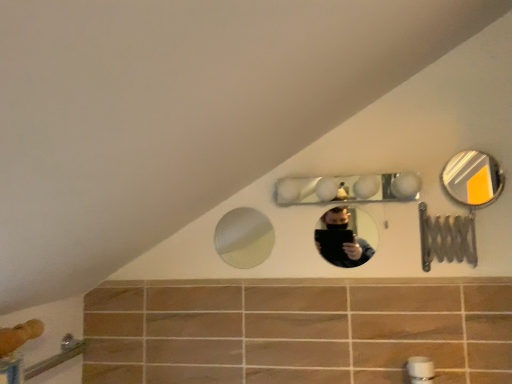
Question: Is clear glass mirror at upper center, the 3th mirror viewed from the left, to the left of metallic silver mirror at upper right, arranged as the fourth mirror when viewed from the left, from the viewer's perspective?

Choices:
 (A) yes
 (B) no

Answer: (A)

Question: Does clear glass mirror at upper center, the 2th mirror when ordered from right to left, turn towards metallic silver mirror at upper right, which is counted as the first mirror, starting from the right?

Choices:
 (A) no
 (B) yes

Answer: (A)

Question: Can metallic silver mirror at upper right, which is counted as the first mirror, starting from the right, be found inside clear glass mirror at upper center, the 3th mirror viewed from the left?

Choices:
 (A) yes
 (B) no

Answer: (B)

Question: Does clear glass mirror at upper center, the 3th mirror viewed from the left, have a lesser height compared to metallic silver mirror at upper right, which is counted as the first mirror, starting from the right?

Choices:
 (A) yes
 (B) no

Answer: (A)

Question: Does clear glass mirror at upper center, the 3th mirror viewed from the left, have a lesser width compared to metallic silver mirror at upper right, arranged as the fourth mirror when viewed from the left?

Choices:
 (A) yes
 (B) no

Answer: (B)

Question: Considering the positions of white glossy mirror at upper center, which is the third mirror from right to left, and clear glass mirror at upper center, the 2th mirror when ordered from right to left, in the image, is white glossy mirror at upper center, which is the third mirror from right to left, taller or shorter than clear glass mirror at upper center, the 2th mirror when ordered from right to left,?

Choices:
 (A) short
 (B) tall

Answer: (A)

Question: In the image, is white glossy mirror at upper center, which is the third mirror from right to left, positioned in front of or behind clear glass mirror at upper center, the 2th mirror when ordered from right to left?

Choices:
 (A) behind
 (B) front

Answer: (B)

Question: Does point (336, 198) appear closer or farther from the camera than point (361, 253)?

Choices:
 (A) closer
 (B) farther

Answer: (A)

Question: Considering the positions of white glossy mirror at upper center, which is the third mirror from right to left, and clear glass mirror at upper center, the 2th mirror when ordered from right to left, in the image, is white glossy mirror at upper center, which is the third mirror from right to left, bigger or smaller than clear glass mirror at upper center, the 2th mirror when ordered from right to left,?

Choices:
 (A) big
 (B) small

Answer: (A)

Question: Considering the positions of white glossy mirror at upper center, positioned as the second mirror in left-to-right order, and metallic silver mirror at upper right, which is counted as the first mirror, starting from the right, in the image, is white glossy mirror at upper center, positioned as the second mirror in left-to-right order, taller or shorter than metallic silver mirror at upper right, which is counted as the first mirror, starting from the right,?

Choices:
 (A) tall
 (B) short

Answer: (B)

Question: Which is correct: white glossy mirror at upper center, positioned as the second mirror in left-to-right order, is inside metallic silver mirror at upper right, which is counted as the first mirror, starting from the right, or outside of it?

Choices:
 (A) inside
 (B) outside

Answer: (B)

Question: In terms of width, does white glossy mirror at upper center, positioned as the second mirror in left-to-right order, look wider or thinner when compared to metallic silver mirror at upper right, arranged as the fourth mirror when viewed from the left?

Choices:
 (A) wide
 (B) thin

Answer: (A)

Question: Does point (316, 190) appear closer or farther from the camera than point (478, 185)?

Choices:
 (A) closer
 (B) farther

Answer: (A)

Question: In the image, is clear glass mirror at upper center, the 2th mirror when ordered from right to left, positioned in front of or behind metallic silver mirror at upper right, which is counted as the first mirror, starting from the right?

Choices:
 (A) front
 (B) behind

Answer: (B)

Question: Is clear glass mirror at upper center, the 3th mirror viewed from the left, spatially inside metallic silver mirror at upper right, which is counted as the first mirror, starting from the right, or outside of it?

Choices:
 (A) outside
 (B) inside

Answer: (A)